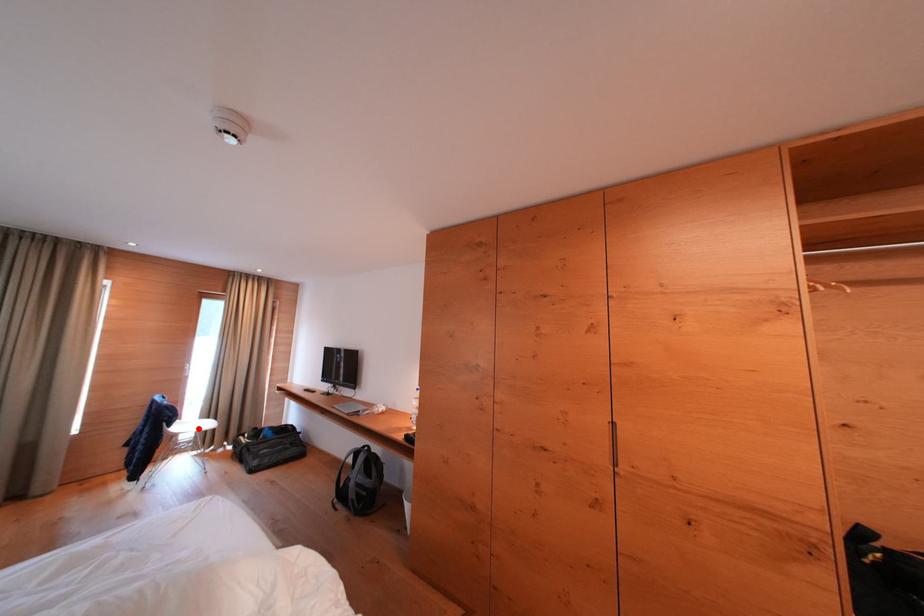
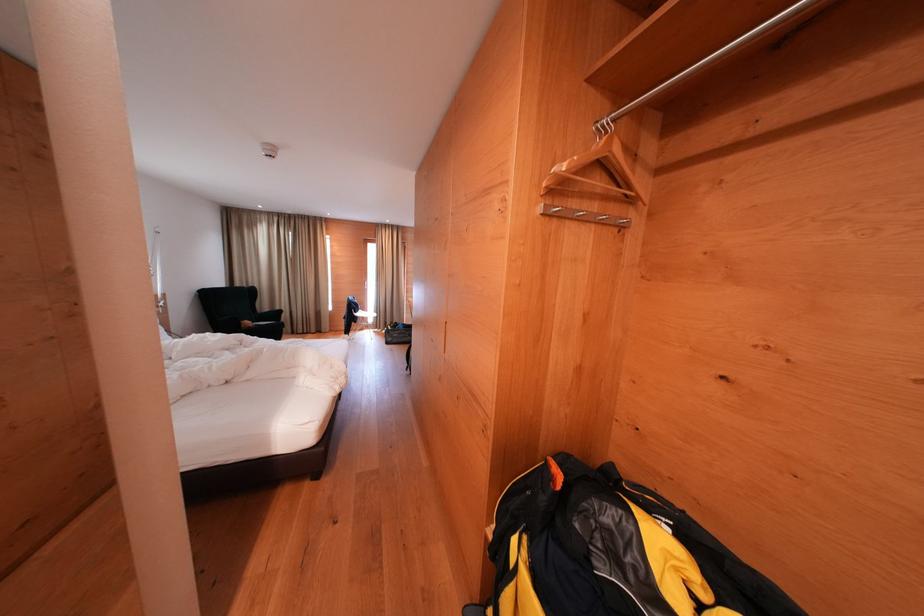
Question: A red point is marked in image1. In image2, is the corresponding 3D point closer to the camera or farther? Reply with the corresponding letter.

Choices:
 (A) The corresponding 3D point is closer.
 (B) The corresponding 3D point is farther.

Answer: (A)